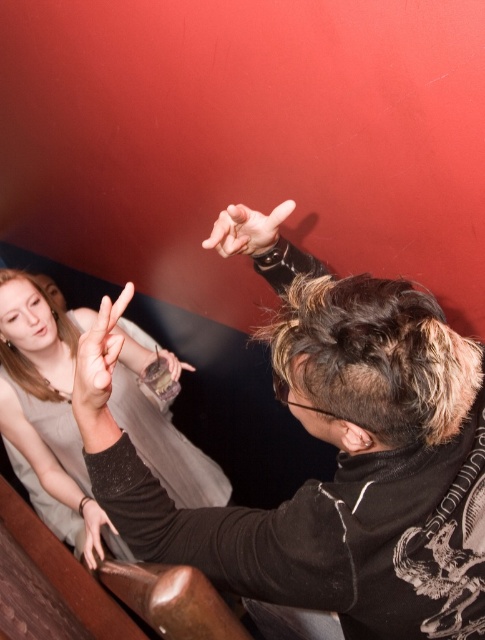
You are standing in a dimly lit bar and see two points in the image. The first point is at coordinate point (359, 289) and the second is at point (237, 243). Which point is closer to you?

Point (359, 289) is closer to the camera than point (237, 243).

You are a photographer standing at the camera position. You want to take a closeup shot of the black matte jacket at upper center. Can you focus on it without adjusting your camera position?

The black matte jacket at upper center is 22.29 inches away from camera, so yes, the photographer can focus on it without adjusting the camera position since it is within the typical focusing range of most cameras.

You are a photographer trying to capture a closeup of both hands in the scene. Given that the smooth skin hand at center and the smooth skin hand at lower left are both visible, which hand should you focus on to ensure it takes up more of the frame?

The smooth skin hand at lower left should be focused on because it occupies more space in the frame compared to the smooth skin hand at center.